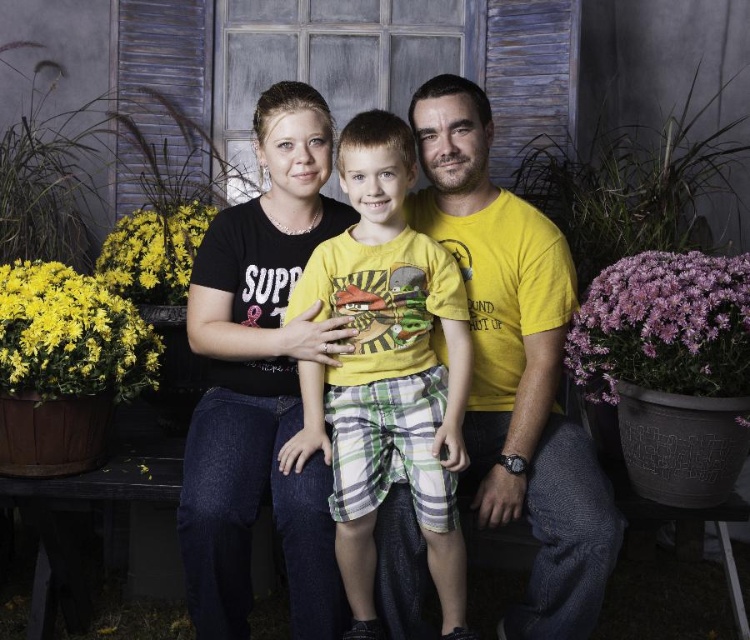
This screenshot has width=750, height=640. I want to click on yellow matte shirt at center, so pyautogui.click(x=516, y=365).

Does yellow matte shirt at center have a greater width compared to black corduroy shirt at center?

Yes.

Who is more forward, (606, 532) or (242, 284)?

Point (606, 532) is more forward.

Image resolution: width=750 pixels, height=640 pixels. Identify the location of yellow matte shirt at center. (516, 365).

Can you confirm if black corduroy shirt at center is positioned above yellow cotton shirt at center?

Yes.

Who is higher up, black corduroy shirt at center or yellow cotton shirt at center?

black corduroy shirt at center is above.

Describe the element at coordinates (261, 381) in the screenshot. I see `black corduroy shirt at center` at that location.

Where is `black corduroy shirt at center`? The height and width of the screenshot is (640, 750). black corduroy shirt at center is located at coordinates (261, 381).

Is yellow matte shirt at center taller than yellow cotton shirt at center?

Correct, yellow matte shirt at center is much taller as yellow cotton shirt at center.

Which is above, yellow matte shirt at center or yellow cotton shirt at center?

yellow cotton shirt at center is higher up.

Locate an element on the screen. yellow matte shirt at center is located at coordinates (516, 365).